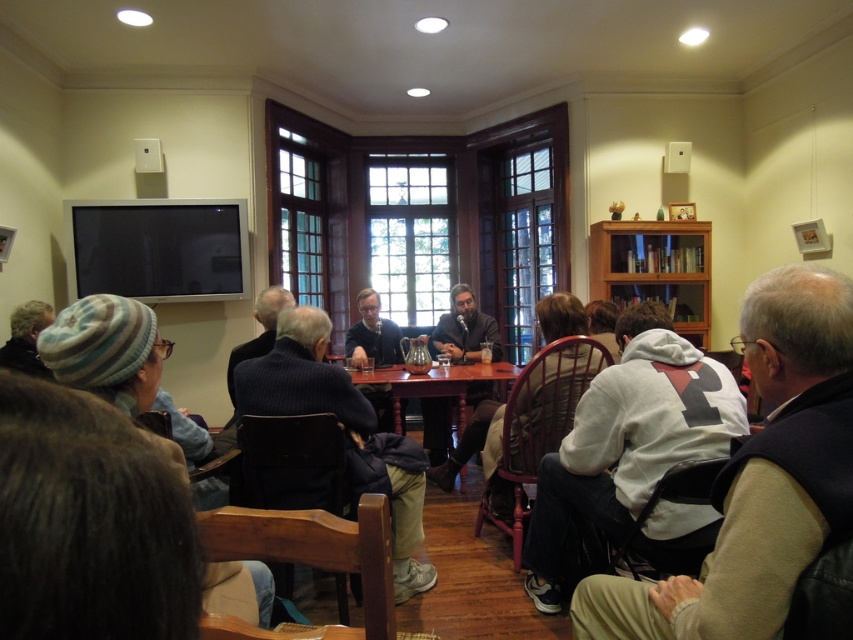
You are organizing a coat check for an event and need to determine if a small coat rack can accommodate both the white fleece jacket at lower right and the striped wool hat at lower left. The rack has two hooks, one slightly larger than the other. Which hook should each item be placed on?

The white fleece jacket at lower right is bigger than the striped wool hat at lower left, so the larger hook should be used for the white fleece jacket at lower right and the smaller hook for the striped wool hat at lower left.

You are an event organizer who needs to place a 1.5 meter tall banner stand in this room. The banner stand requires a space that is taller than the white fleece jacket at lower right. Is there enough vertical space between the wooden table at center and the ceiling to accommodate the banner stand?

The white fleece jacket at lower right is taller than the wooden table at center. Since the banner stand needs to be taller than the jacket, and the table is shorter than the jacket, there might not be enough vertical space between the wooden table at center and the ceiling to safely accommodate the banner stand without it being too close to the ceiling. However, the exact height of the ceiling isn